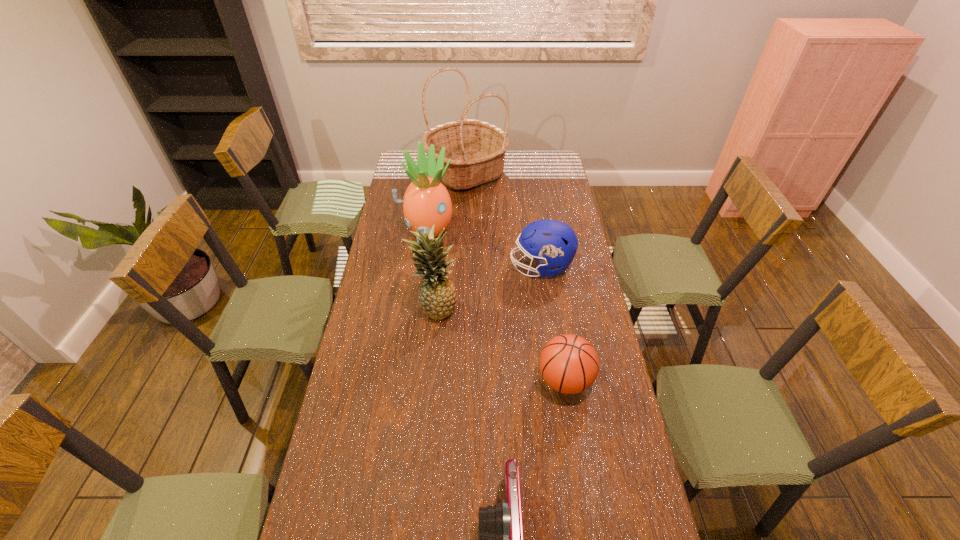
The width and height of the screenshot is (960, 540). Identify the location of the farthest object. (476, 148).

You are a GUI agent. You are given a task and a screenshot of the screen. Output one action in this format:
    pyautogui.click(x=<x>, y=<y>)
    Task: Click on the basket
    
    Given the screenshot: What is the action you would take?
    pyautogui.click(x=476, y=148)

The height and width of the screenshot is (540, 960). What are the coordinates of `the second farthest object` in the screenshot? It's located at (426, 201).

Identify the location of the fourth farthest object. (437, 295).

This screenshot has height=540, width=960. I want to click on football helmet, so click(x=552, y=243).

You are a GUI agent. You are given a task and a screenshot of the screen. Output one action in this format:
    pyautogui.click(x=<x>, y=<y>)
    Task: Click on the fourth tallest object
    This screenshot has height=540, width=960.
    Given the screenshot: What is the action you would take?
    pyautogui.click(x=552, y=243)

Locate an element on the screen. Image resolution: width=960 pixels, height=540 pixels. basketball is located at coordinates (569, 364).

Locate an element on the screen. This screenshot has width=960, height=540. the second nearest object is located at coordinates (569, 364).

At what (x,y) coordinates should I click in order to perform the action: click on vacant space located on the right of the farthest object. Please return your answer as a coordinate pair (x, y). This screenshot has width=960, height=540. Looking at the image, I should click on (549, 172).

You are a GUI agent. You are given a task and a screenshot of the screen. Output one action in this format:
    pyautogui.click(x=<x>, y=<y>)
    Task: Click on the vacant space located 0.360m at the entrance of the fifth nearest object
    The width and height of the screenshot is (960, 540).
    Given the screenshot: What is the action you would take?
    pyautogui.click(x=416, y=311)